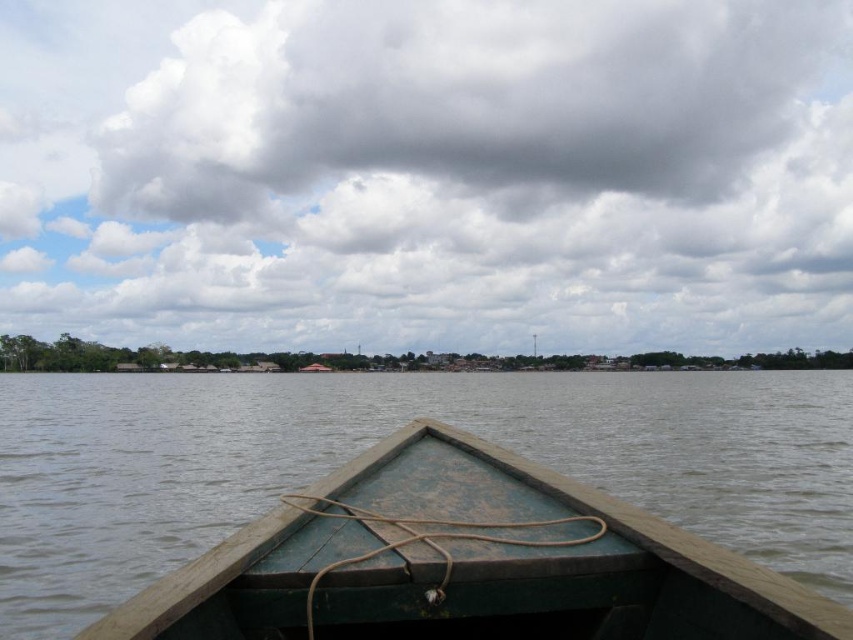
Is cloudy sky at upper center smaller than green weathered wood boat at center?

Incorrect, cloudy sky at upper center is not smaller in size than green weathered wood boat at center.

Between cloudy sky at upper center and green weathered wood boat at center, which one has more height?

cloudy sky at upper center

Is point (585, 236) positioned after point (383, 481)?

Yes, point (585, 236) is behind point (383, 481).

The image size is (853, 640). What are the coordinates of `cloudy sky at upper center` in the screenshot? It's located at (428, 173).